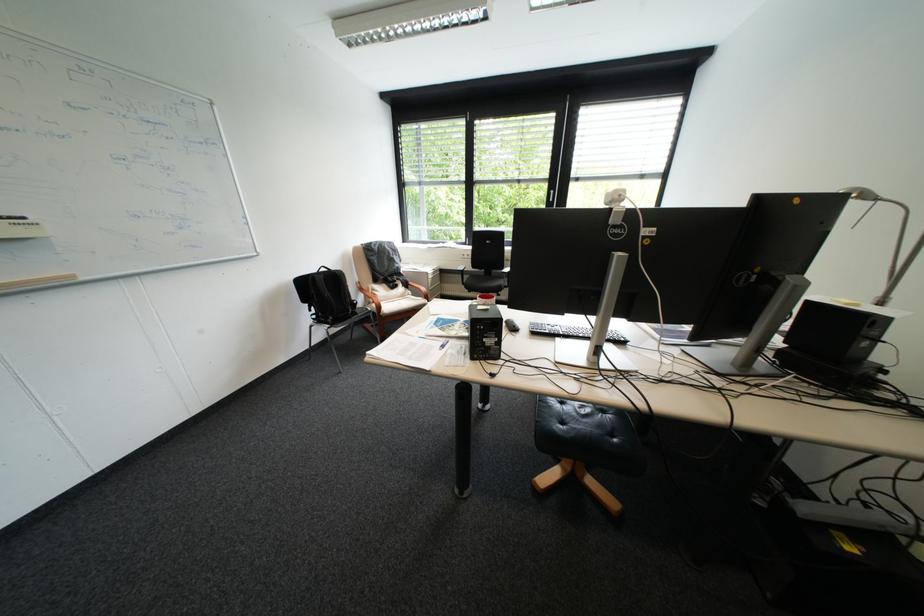
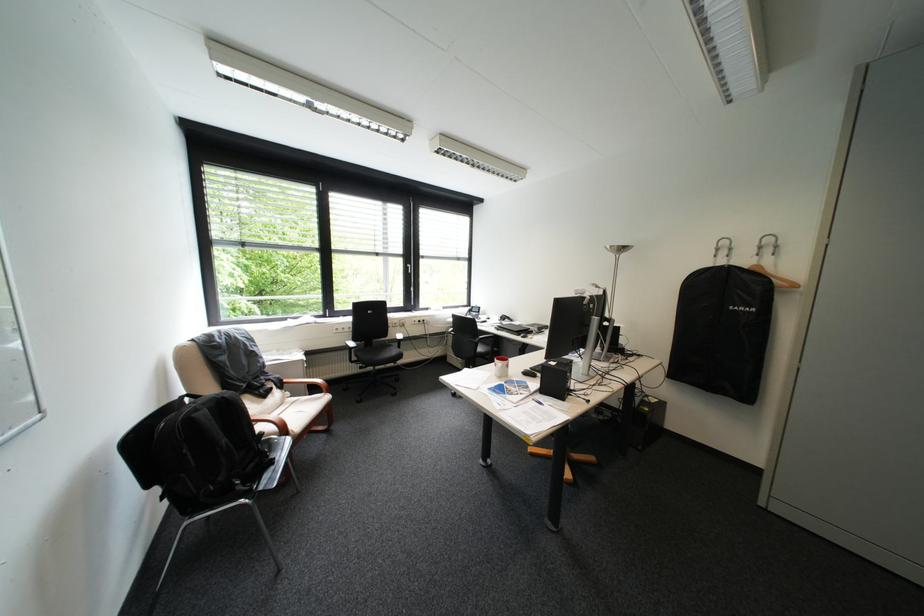
Locate, in the second image, the point that corresponds to [419,283] in the first image.

(294, 381)